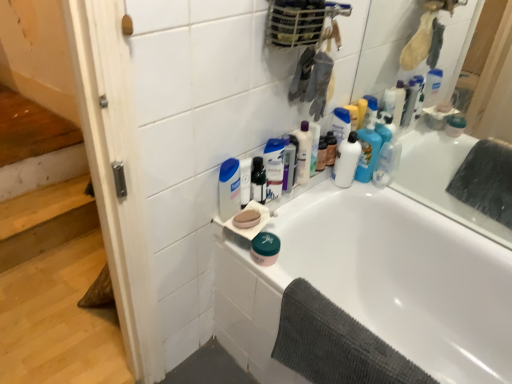
Question: Does clear plastic bottle at upper center, which is the 2th cleaning product in right-to-left order, have a lesser height compared to white matte lotion at upper right, which is the 1th cleaning product from left to right?

Choices:
 (A) no
 (B) yes

Answer: (A)

Question: Considering the relative sizes of clear plastic bottle at upper center, acting as the second cleaning product starting from the back, and white matte lotion at upper right, marked as the third cleaning product in a right-to-left arrangement, in the image provided, is clear plastic bottle at upper center, acting as the second cleaning product starting from the back, wider than white matte lotion at upper right, marked as the third cleaning product in a right-to-left arrangement,?

Choices:
 (A) yes
 (B) no

Answer: (A)

Question: From the image's perspective, is clear plastic bottle at upper center, the 2th cleaning product when ordered from left to right, on white matte lotion at upper right, the first cleaning product in the front-to-back sequence?

Choices:
 (A) no
 (B) yes

Answer: (B)

Question: Is clear plastic bottle at upper center, which is the 2th cleaning product in right-to-left order, positioned in front of white matte lotion at upper right, which is the 1th cleaning product from left to right?

Choices:
 (A) yes
 (B) no

Answer: (B)

Question: From a real-world perspective, is clear plastic bottle at upper center, acting as the second cleaning product starting from the back, over white matte lotion at upper right, the first cleaning product in the front-to-back sequence?

Choices:
 (A) yes
 (B) no

Answer: (A)

Question: In terms of size, does wooden stairs at left appear bigger or smaller than clear plastic bottle at upper center, which is the 2th cleaning product in right-to-left order?

Choices:
 (A) small
 (B) big

Answer: (B)

Question: In the image, is wooden stairs at left on the left side or the right side of clear plastic bottle at upper center, acting as the second cleaning product starting from the back?

Choices:
 (A) left
 (B) right

Answer: (A)

Question: From a real-world perspective, relative to clear plastic bottle at upper center, acting as the second cleaning product starting from the back, is wooden stairs at left vertically above or below?

Choices:
 (A) below
 (B) above

Answer: (A)

Question: Considering the positions of wooden stairs at left and clear plastic bottle at upper center, the 2th cleaning product when ordered from left to right, in the image, is wooden stairs at left taller or shorter than clear plastic bottle at upper center, the 2th cleaning product when ordered from left to right,?

Choices:
 (A) tall
 (B) short

Answer: (B)

Question: Considering the positions of white glossy bottle at upper right, placed as the first cleaning product when sorted from back to front, and clear plastic bottle at upper center, acting as the second cleaning product starting from the back, in the image, is white glossy bottle at upper right, placed as the first cleaning product when sorted from back to front, bigger or smaller than clear plastic bottle at upper center, acting as the second cleaning product starting from the back,?

Choices:
 (A) big
 (B) small

Answer: (A)

Question: Considering their positions, is white glossy bottle at upper right, acting as the third cleaning product starting from the left, located in front of or behind clear plastic bottle at upper center, the 2th cleaning product when ordered from left to right?

Choices:
 (A) front
 (B) behind

Answer: (B)

Question: From the image's perspective, relative to clear plastic bottle at upper center, which is the 2th cleaning product in right-to-left order, is white glossy bottle at upper right, which is the first cleaning product in right-to-left order, above or below?

Choices:
 (A) above
 (B) below

Answer: (B)

Question: Which is correct: white glossy bottle at upper right, which is the first cleaning product in right-to-left order, is inside clear plastic bottle at upper center, the 2th cleaning product when ordered from left to right, or outside of it?

Choices:
 (A) inside
 (B) outside

Answer: (B)

Question: Which is correct: pink matte soap at upper center is inside dark gray textured towel at lower right, or outside of it?

Choices:
 (A) outside
 (B) inside

Answer: (A)

Question: Considering the positions of pink matte soap at upper center and dark gray textured towel at lower right in the image, is pink matte soap at upper center wider or thinner than dark gray textured towel at lower right?

Choices:
 (A) wide
 (B) thin

Answer: (B)